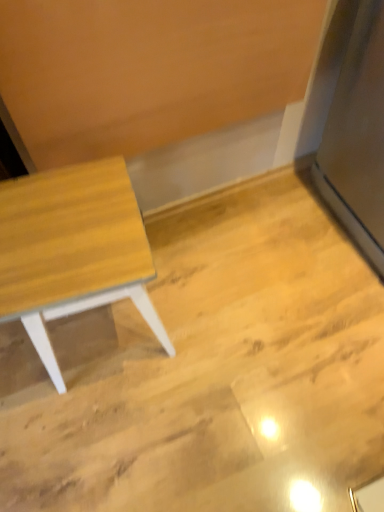
The height and width of the screenshot is (512, 384). In order to click on vacant space underneath light wood table at left (from a real-world perspective) in this screenshot , I will do `click(104, 334)`.